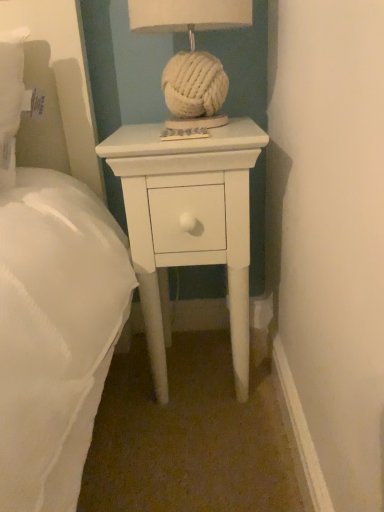
This screenshot has height=512, width=384. Find the location of `empty space that is ontop of white matte nightstand at center`. empty space that is ontop of white matte nightstand at center is located at coordinates (168, 132).